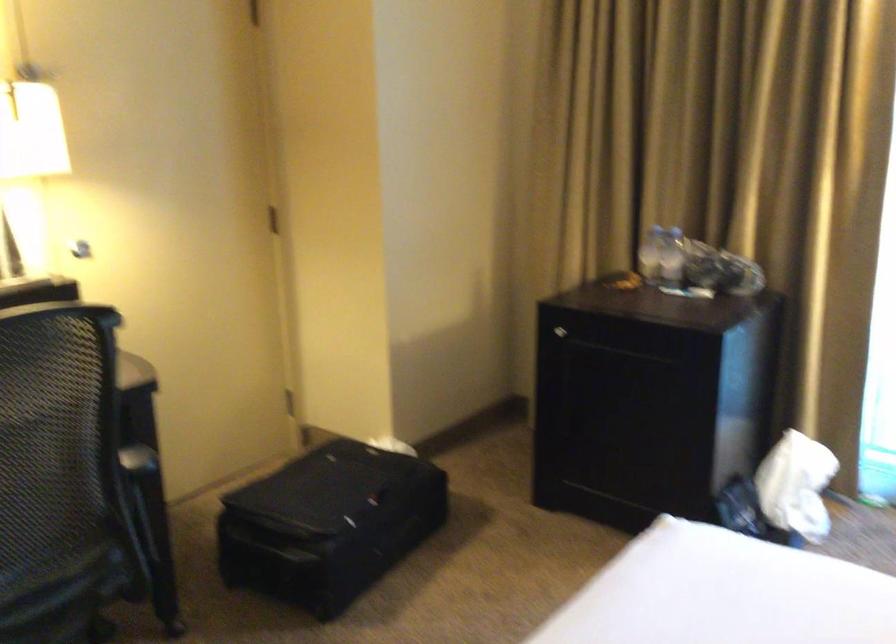
What do you see at coordinates (136, 527) in the screenshot? I see `the black chair armrest` at bounding box center [136, 527].